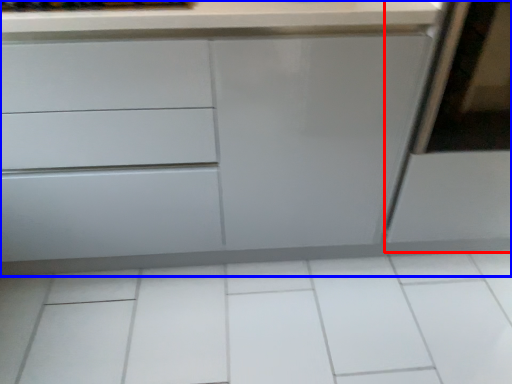
Question: Which object appears closest to the camera in this image, screen door (highlighted by a red box) or chest of drawers (highlighted by a blue box)?

Choices:
 (A) screen door
 (B) chest of drawers

Answer: (B)